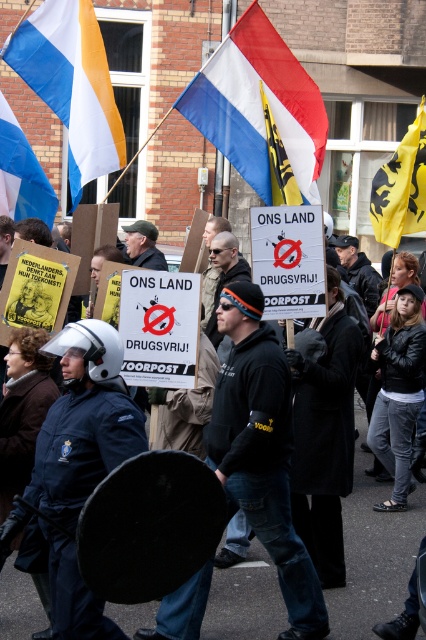
You are a photographer standing at the edge of the protest area. You want to capture a photo of the blue uniform at center and the yellow fabric flag at upper right in the same frame. Given that your camera has a maximum focus range of 4 meters, will both subjects be within the focus range?

The distance between the blue uniform at center and the yellow fabric flag at upper right is 4.31 meters. Since the camera can only focus up to 4 meters, the subjects are slightly out of range and cannot be captured in focus simultaneously.

You are a photographer standing at the edge of the crowd. You want to take a photo that includes both the blue uniform at center and the blue and white striped flag at center. Given that your camera has a maximum focus range of 4 meters, will you be able to capture both subjects in focus without moving closer?

The blue uniform at center and the blue and white striped flag at center are 4.43 meters apart. Since the distance between them exceeds the camera maximum focus range of 4 meters, you will not be able to capture both subjects in focus without moving closer.

You are a photographer trying to capture the blue uniform at center and the yellow fabric flag at upper right in a single frame. Based on their sizes, which object would appear larger in your photo?

The blue uniform at center would appear larger in the photo because its width is larger than that of the yellow fabric flag at upper right.